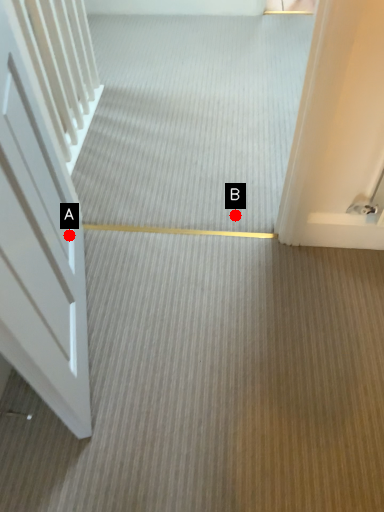
Question: Two points are circled on the image, labeled by A and B beside each circle. Which point is further to the camera?

Choices:
 (A) A is further
 (B) B is further

Answer: (B)